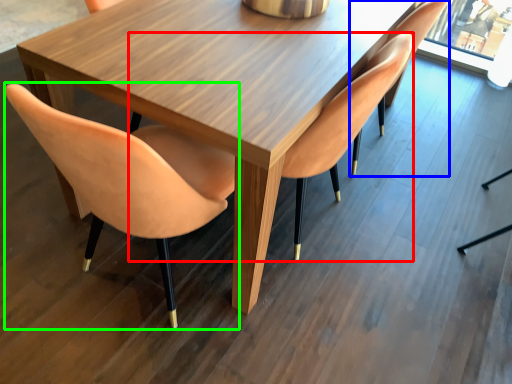
Question: Considering the real-world distances, which object is farthest from chair (highlighted by a red box)? chair (highlighted by a blue box) or chair (highlighted by a green box)?

Choices:
 (A) chair
 (B) chair

Answer: (B)